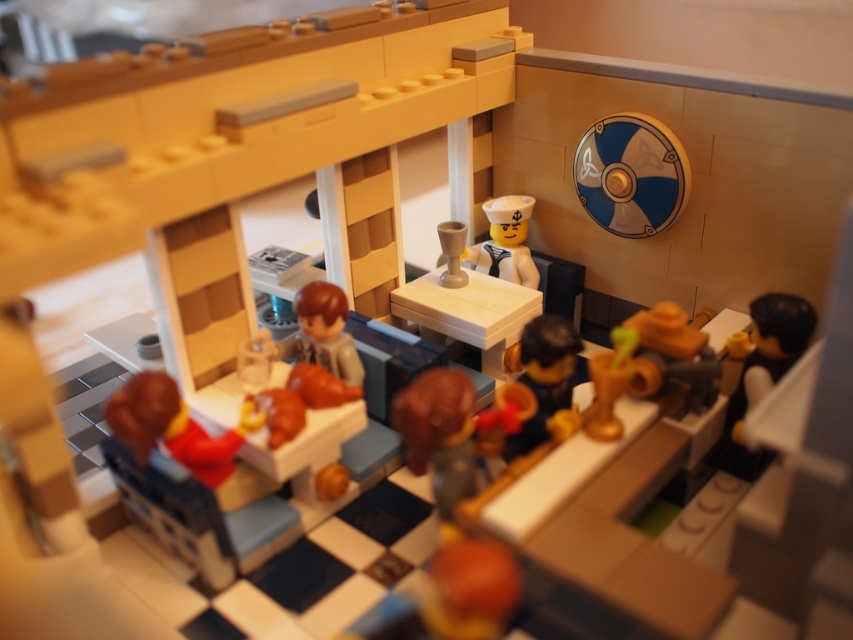
You are a customer at the LEGO diner and want to grab the shiny brown bowl at center to take a drink. However, there is a satin white sailor hat at upper center in the way. Can you reach the bowl without moving the hat?

The shiny brown bowl at center is closer to the viewer than the satin white sailor hat at upper center, so you can reach the bowl without moving the hat since it is in front of the hat.

In the LEGO diorama, there is a point labeled as point (323, 332). Which LEGO minifigure is located at this point?

The point (323, 332) corresponds to the smooth brown minifigure at center.

In the LEGO diorama of the cozy diner scene, there is a shiny brown bowl at center and a smooth brown minifigure at center. Which object is taller?

The shiny brown bowl at center is taller than the smooth brown minifigure at center.